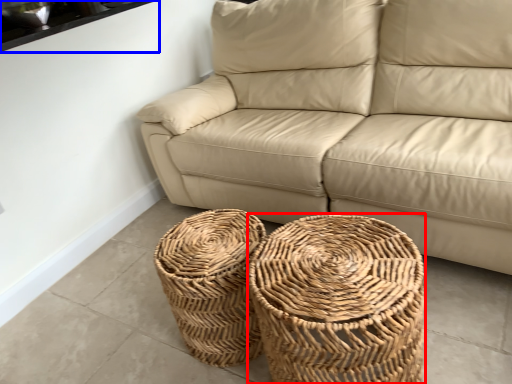
Question: Which point is closer to the camera, basket (highlighted by a red box) or window sill (highlighted by a blue box)?

Choices:
 (A) basket
 (B) window sill

Answer: (A)